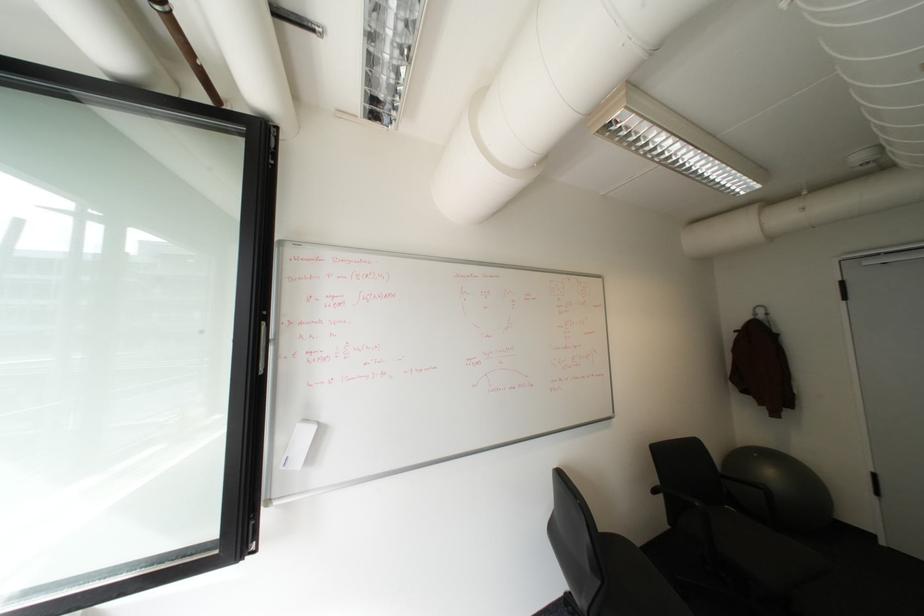
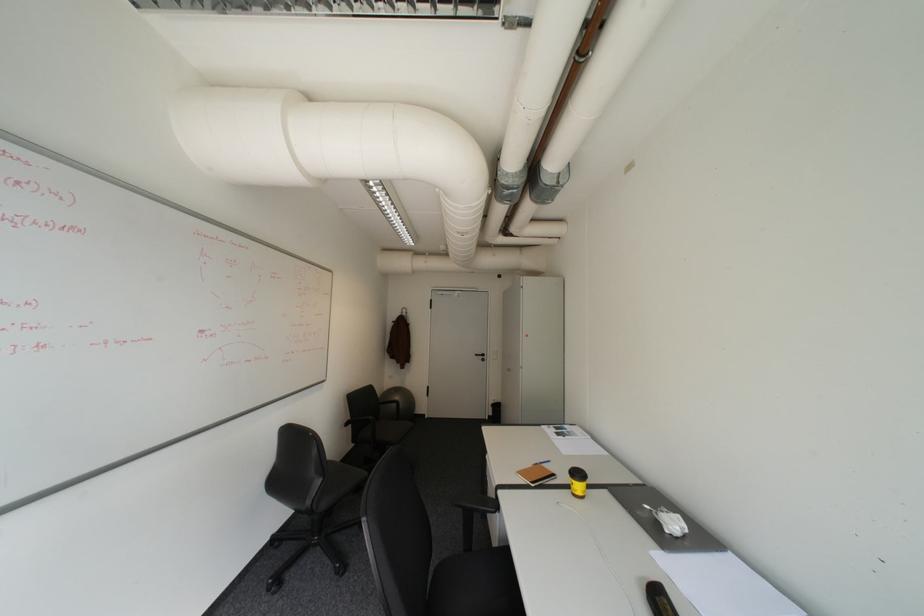
Find the pixel in the second image that matches the point at 671,496 in the first image.

(359, 426)